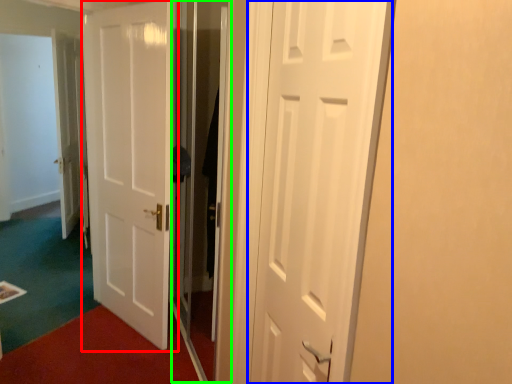
Question: Based on their relative distances, which object is farther from door (highlighted by a red box)? Choose from door (highlighted by a blue box) and screen door (highlighted by a green box).

Choices:
 (A) door
 (B) screen door

Answer: (A)